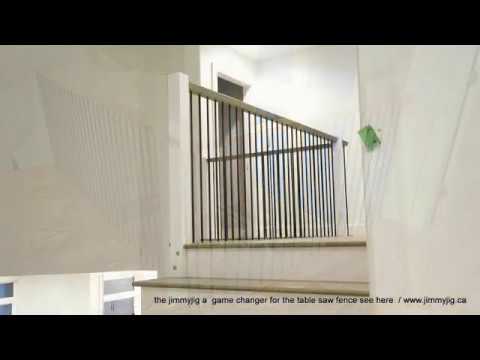
What are the coordinates of `open entrance on landing at top of stairs` in the screenshot? It's located at (223, 85).